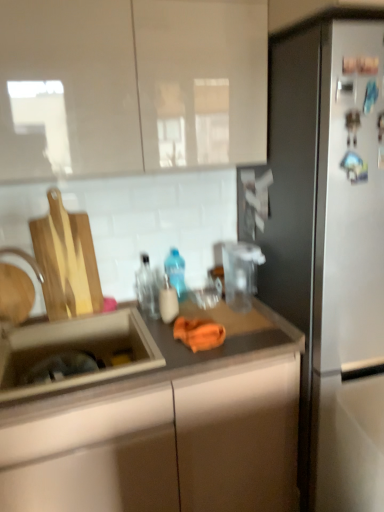
Question: Which direction should I rotate to look at blue translucent bottle at center, which ranks as the 3th bottle in front-to-back order?

Choices:
 (A) right
 (B) left

Answer: (B)

Question: Is blue translucent bottle at center, which ranks as the 3th bottle in front-to-back order, to the right of stainless steel refrigerator at right from the viewer's perspective?

Choices:
 (A) no
 (B) yes

Answer: (A)

Question: From a real-world perspective, does blue translucent bottle at center, marked as the 1th bottle in a back-to-front arrangement, stand above stainless steel refrigerator at right?

Choices:
 (A) yes
 (B) no

Answer: (A)

Question: From a real-world perspective, is blue translucent bottle at center, which ranks as the 3th bottle in front-to-back order, below stainless steel refrigerator at right?

Choices:
 (A) yes
 (B) no

Answer: (B)

Question: Does blue translucent bottle at center, which ranks as the 3th bottle in front-to-back order, have a greater width compared to stainless steel refrigerator at right?

Choices:
 (A) yes
 (B) no

Answer: (B)

Question: Is the position of blue translucent bottle at center, marked as the 1th bottle in a back-to-front arrangement, more distant than that of stainless steel refrigerator at right?

Choices:
 (A) no
 (B) yes

Answer: (B)

Question: Is blue translucent bottle at center, marked as the 1th bottle in a back-to-front arrangement, next to stainless steel refrigerator at right?

Choices:
 (A) no
 (B) yes

Answer: (A)

Question: Does glossy white cabinet at upper center turn towards transparent glass bottle at center, the second bottle when ordered from back to front?

Choices:
 (A) yes
 (B) no

Answer: (B)

Question: Is glossy white cabinet at upper center next to transparent glass bottle at center, which is the second bottle from front to back?

Choices:
 (A) no
 (B) yes

Answer: (A)

Question: Does glossy white cabinet at upper center come in front of transparent glass bottle at center, which is the second bottle from front to back?

Choices:
 (A) no
 (B) yes

Answer: (B)

Question: Does glossy white cabinet at upper center have a lesser width compared to transparent glass bottle at center, which is the second bottle from front to back?

Choices:
 (A) yes
 (B) no

Answer: (B)

Question: Does glossy white cabinet at upper center appear on the left side of transparent glass bottle at center, which is the second bottle from front to back?

Choices:
 (A) no
 (B) yes

Answer: (B)

Question: Is glossy white cabinet at upper center turned away from transparent glass bottle at center, which is the second bottle from front to back?

Choices:
 (A) no
 (B) yes

Answer: (A)

Question: Is brushed metal faucet at sink left at the back of matte plastic soap dispenser at center, marked as the first bottle in a front-to-back arrangement?

Choices:
 (A) yes
 (B) no

Answer: (B)